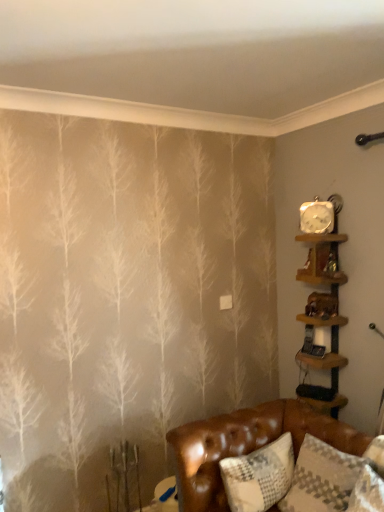
Question: From a real-world perspective, relative to metallic silver clock at upper right, is brown leather couch at lower right vertically above or below?

Choices:
 (A) above
 (B) below

Answer: (B)

Question: From the image's perspective, is brown leather couch at lower right above or below metallic silver clock at upper right?

Choices:
 (A) above
 (B) below

Answer: (B)

Question: Considering the real-world distances, which object is farthest from the brown leather couch at lower right?

Choices:
 (A) white textured pillow at lower right
 (B) wooden shelf at upper right, which is counted as the 1th shelf, starting from the top
 (C) wooden shelf at right, the 1th shelf in the bottom-to-top sequence
 (D) metallic silver clock at upper right

Answer: (D)

Question: Which of these objects is positioned closest to the brown leather couch at lower right?

Choices:
 (A) wooden shelf at right, acting as the second shelf starting from the top
 (B) metallic silver clock at upper right
 (C) white textured pillow at lower right
 (D) wooden shelf at upper right, marked as the 2th shelf in a bottom-to-top arrangement

Answer: (C)